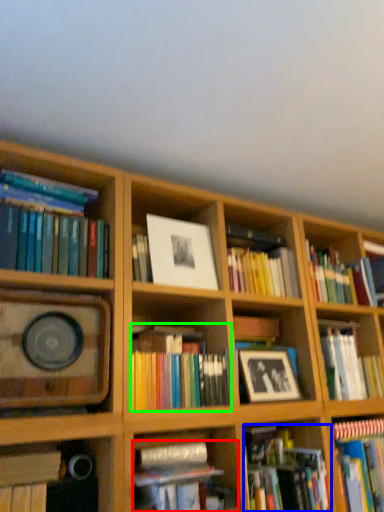
Question: Based on their relative distances, which object is nearer to book (highlighted by a red box)? Choose from book (highlighted by a blue box) and book (highlighted by a green box).

Choices:
 (A) book
 (B) book

Answer: (B)